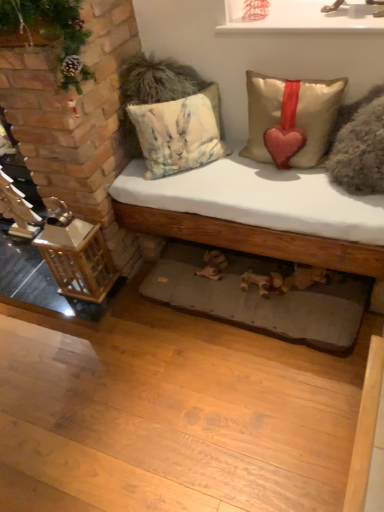
In order to click on vacant region above gray fabric mat at lower center (from a real-world perspective) in this screenshot , I will do `click(245, 273)`.